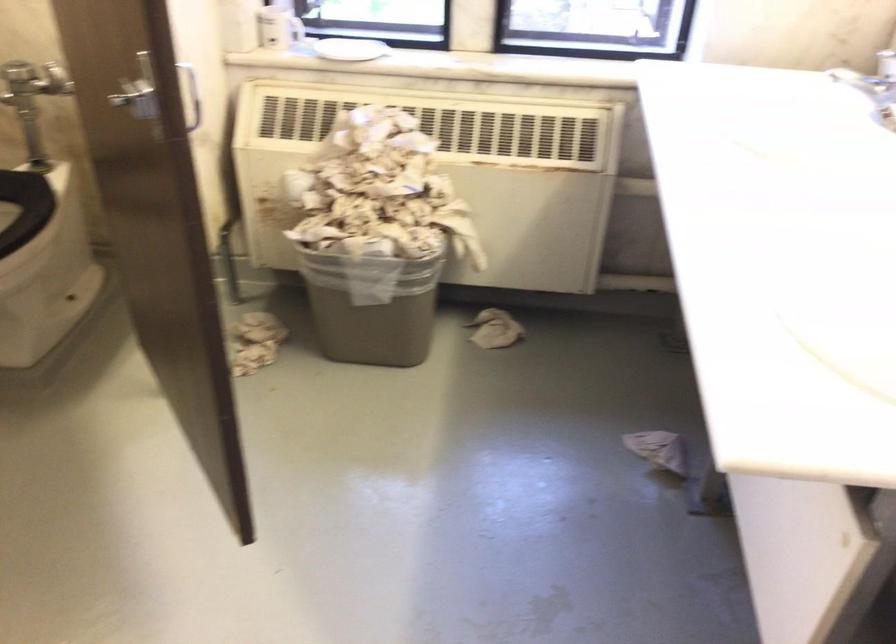
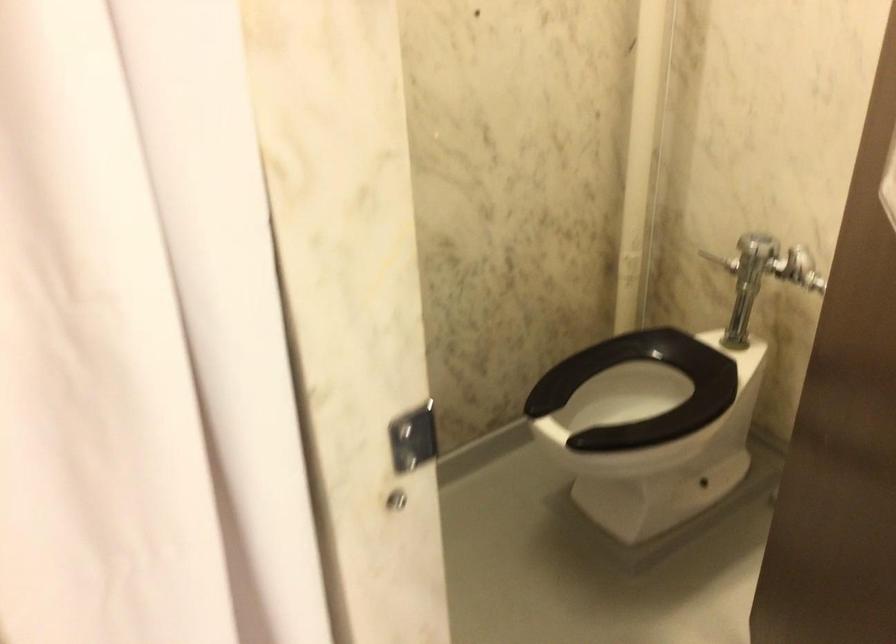
Question: The first image is from the beginning of the video and the second image is from the end. How did the camera likely rotate when shooting the video?

Choices:
 (A) Left
 (B) Right
 (C) Up
 (D) Down

Answer: (A)